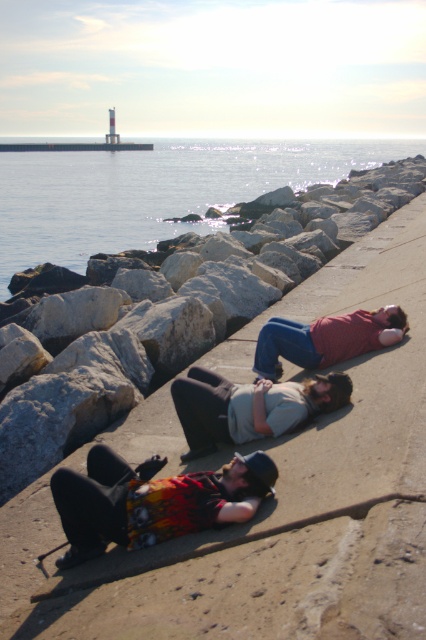
Is printed cotton shirt at lower left thinner than matte red shirt at center?

Correct, printed cotton shirt at lower left's width is less than matte red shirt at center's.

How much distance is there between printed cotton shirt at lower left and matte red shirt at center?

printed cotton shirt at lower left and matte red shirt at center are 7.04 feet apart.

Locate an element on the screen. printed cotton shirt at lower left is located at coordinates (152, 500).

This screenshot has width=426, height=640. I want to click on printed cotton shirt at lower left, so click(x=152, y=500).

The width and height of the screenshot is (426, 640). Describe the element at coordinates (267, 499) in the screenshot. I see `concrete at center` at that location.

Is point (377, 544) more distant than point (250, 392)?

No, it is in front of (250, 392).

Describe the element at coordinates (267, 499) in the screenshot. I see `concrete at center` at that location.

You are a GUI agent. You are given a task and a screenshot of the screen. Output one action in this format:
    pyautogui.click(x=<x>, y=<y>)
    Task: Click on the concrete at center
    Image resolution: width=426 pixels, height=640 pixels.
    Given the screenshot: What is the action you would take?
    pyautogui.click(x=267, y=499)

Between point (374, 476) and point (85, 230), which one is positioned behind?

Positioned behind is point (85, 230).

Does concrete at center have a lesser height compared to clear water at center?

Yes.

Is point (397, 292) closer to viewer compared to point (167, 236)?

Yes, it is.

Identify the location of concrete at center. The width and height of the screenshot is (426, 640). (267, 499).